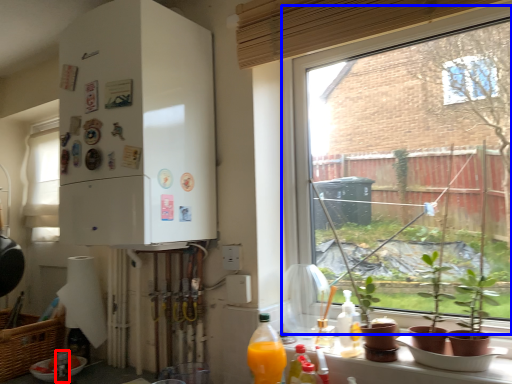
Question: Which of the following is the farthest to the observer, bottle (highlighted by a red box) or window (highlighted by a blue box)?

Choices:
 (A) bottle
 (B) window

Answer: (A)